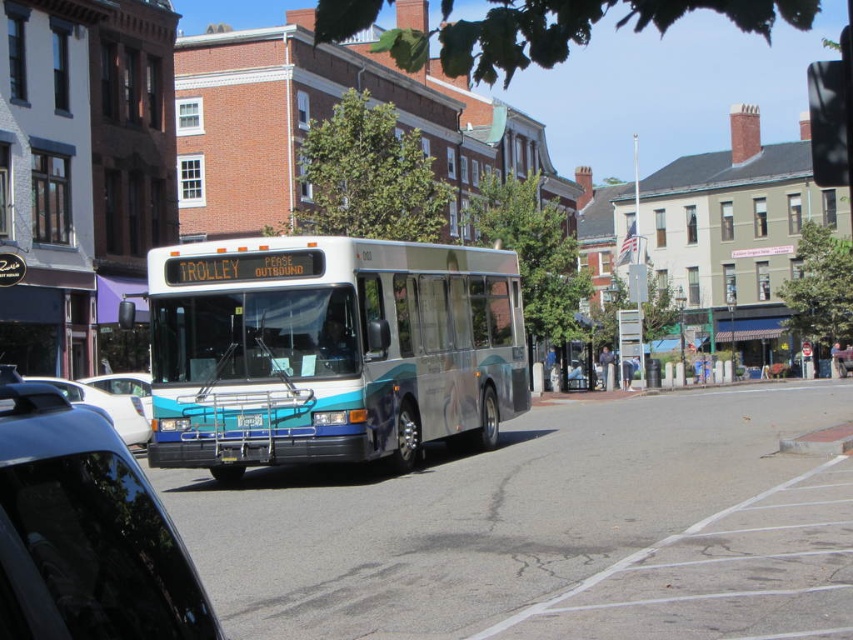
Is teal metallic bus at center further to the viewer compared to metallic silver car at lower left?

No, teal metallic bus at center is closer to the viewer.

The image size is (853, 640). Find the location of `teal metallic bus at center`. teal metallic bus at center is located at coordinates (329, 349).

Which of these two, teal metallic bus at center or white glossy sedan at lower left, stands shorter?

With less height is teal metallic bus at center.

Does teal metallic bus at center appear under white glossy sedan at lower left?

Actually, teal metallic bus at center is above white glossy sedan at lower left.

Does point (248, 262) come closer to viewer compared to point (115, 378)?

That is True.

The height and width of the screenshot is (640, 853). I want to click on teal metallic bus at center, so click(329, 349).

Between black glossy car at left and white glossy sedan at lower left, which one has less height?

black glossy car at left

Between black glossy car at left and white glossy sedan at lower left, which one appears on the left side from the viewer's perspective?

white glossy sedan at lower left

Where is `black glossy car at left`? The image size is (853, 640). black glossy car at left is located at coordinates (85, 531).